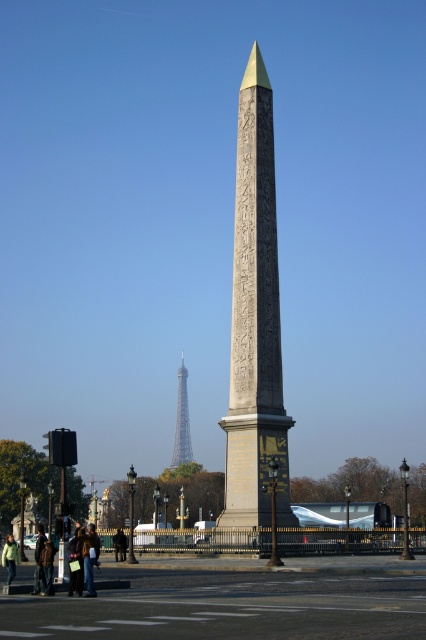
Question: Which object appears closest to the camera in this image?

Choices:
 (A) metallic gold eiffel tower at center
 (B) metallic gold tower at center
 (C) green fabric jacket at lower left

Answer: (C)

Question: Is metallic gold eiffel tower at center smaller than metallic gold tower at center?

Choices:
 (A) yes
 (B) no

Answer: (B)

Question: Can you confirm if metallic gold eiffel tower at center is positioned below green fabric jacket at lower left?

Choices:
 (A) yes
 (B) no

Answer: (B)

Question: Is metallic gold eiffel tower at center closer to camera compared to metallic gold tower at center?

Choices:
 (A) no
 (B) yes

Answer: (B)

Question: Which point appears closest to the camera in this image?

Choices:
 (A) (17, 554)
 (B) (264, 307)
 (C) (181, 458)

Answer: (A)

Question: Which point is closer to the camera taking this photo?

Choices:
 (A) (184, 388)
 (B) (3, 554)
 (C) (259, 465)

Answer: (B)